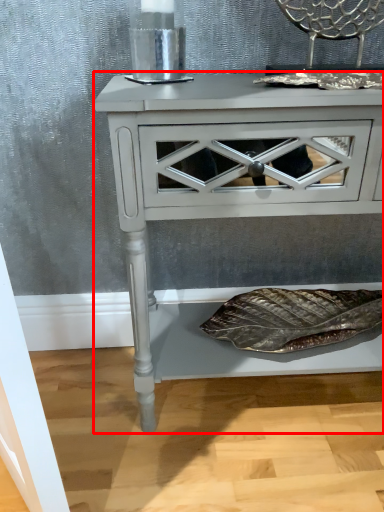
Question: From the image, what is the correct spatial relationship of nightstand (annotated by the red box) in relation to chair?

Choices:
 (A) right
 (B) left

Answer: (B)